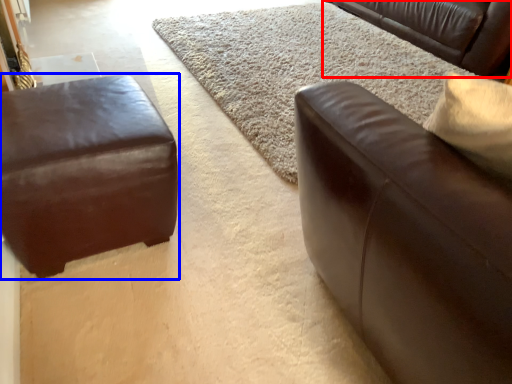
Question: Among these objects, which one is farthest to the camera, studio couch (highlighted by a red box) or studio couch (highlighted by a blue box)?

Choices:
 (A) studio couch
 (B) studio couch

Answer: (A)